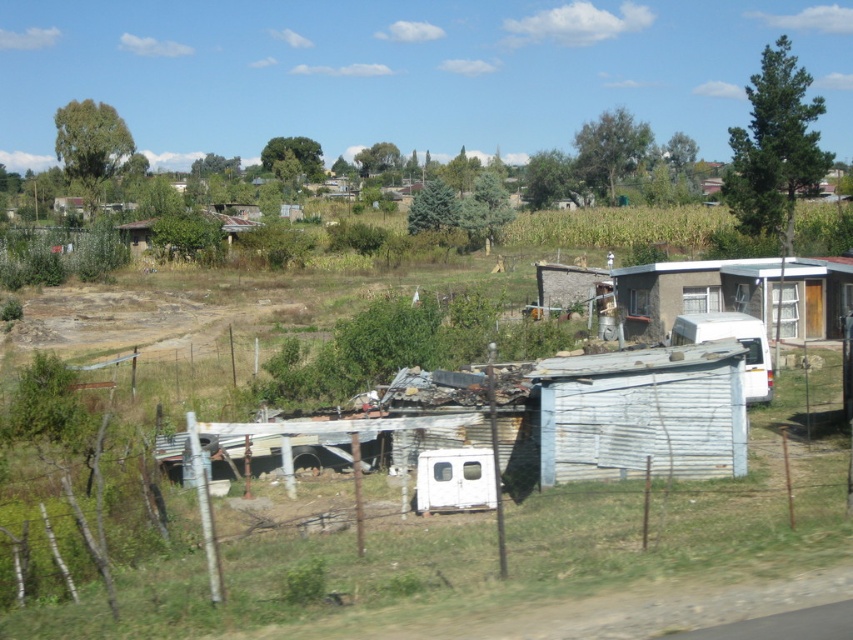
Question: Which object appears closest to the camera in this image?

Choices:
 (A) rusty corrugated hut at center
 (B) white corrugated metal hut at center-right
 (C) white corrugated metal hut at right

Answer: (B)

Question: Does white corrugated metal hut at center-right appear on the left side of rusty corrugated hut at center?

Choices:
 (A) yes
 (B) no

Answer: (B)

Question: Can you confirm if white corrugated metal hut at right is positioned above rusty corrugated hut at center?

Choices:
 (A) yes
 (B) no

Answer: (B)

Question: Which point is closer to the camera?

Choices:
 (A) (146, 220)
 (B) (817, 323)
 (C) (740, 385)

Answer: (C)

Question: Which object is farther from the camera taking this photo?

Choices:
 (A) white corrugated metal hut at right
 (B) white corrugated metal hut at center-right

Answer: (A)

Question: Is white corrugated metal hut at right in front of rusty corrugated hut at center?

Choices:
 (A) yes
 (B) no

Answer: (A)